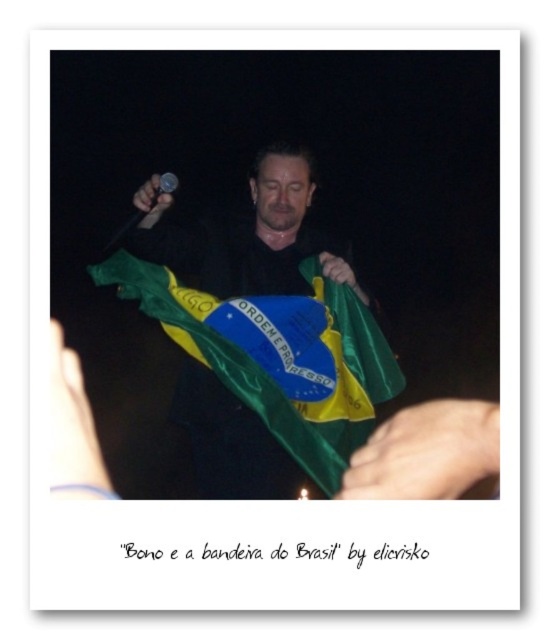
You are a stagehand setting up for a performance. You need to adjust the lighting so that the green fabric hand at lower right and the matte black microphone at upper center are both clearly visible. Given their sizes, which object requires a brighter light to ensure visibility?

The green fabric hand at lower right is larger in size than the matte black microphone at upper center, so it requires a brighter light to ensure visibility.

You are an event photographer at the live performance. You need to capture a closeup shot of the central figure holding the microphone and the Brazilian flag. However, your camera is set to focus on the point at coordinates point (73, 428). Based on the scene description, will this point likely be on the central figure or somewhere else?

The point (73, 428) marks white matte skin at lower left, so it is likely on the central figure holding the microphone and Brazilian flag.